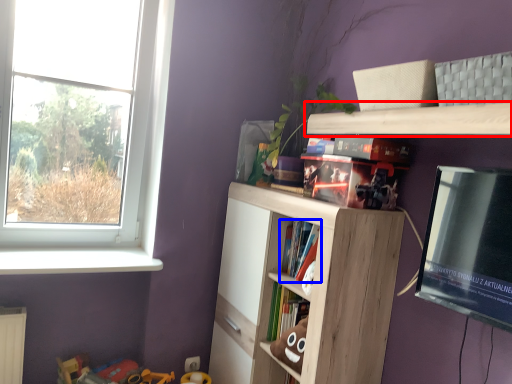
Question: Among these objects, which one is nearest to the camera, shelf (highlighted by a red box) or book (highlighted by a blue box)?

Choices:
 (A) shelf
 (B) book

Answer: (A)